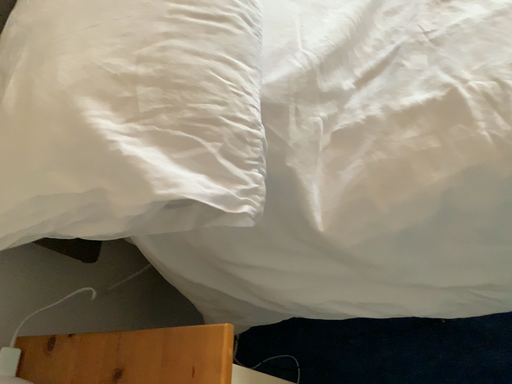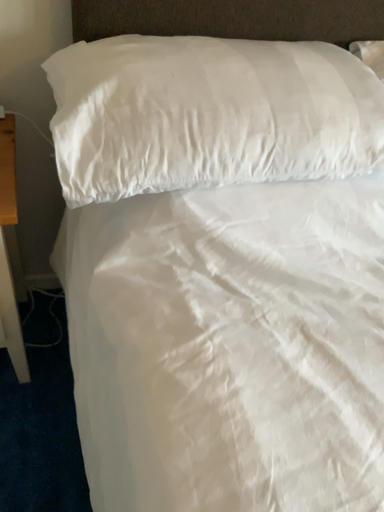
Question: How did the camera likely rotate when shooting the video?

Choices:
 (A) rotated left
 (B) rotated right

Answer: (A)